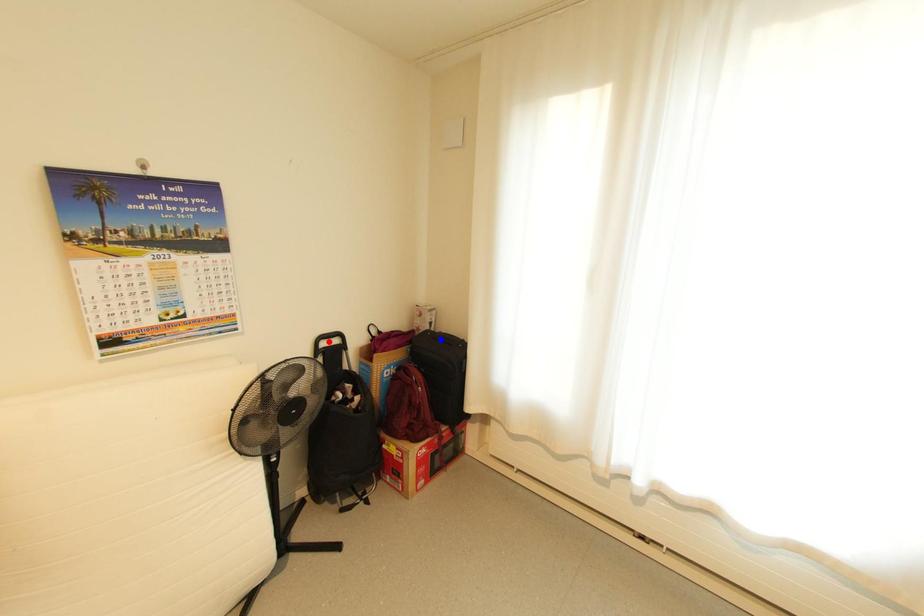
Question: In the image, two points are highlighted. Which point is nearer to the camera? Reply with the corresponding letter.

Choices:
 (A) blue point
 (B) red point

Answer: (B)